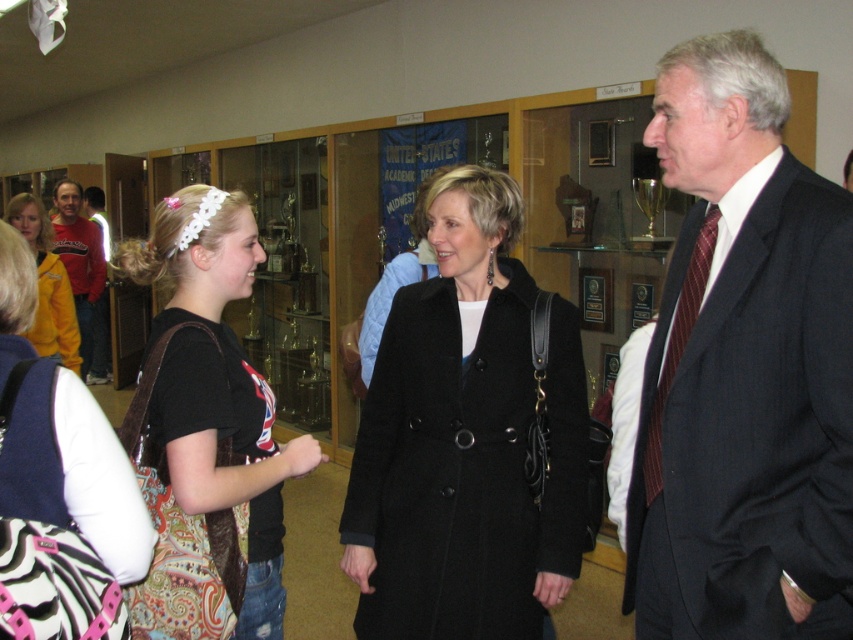
Please describe the position of the black cotton shirt at center in terms of its coordinates within the image frame. The image frame has a coordinate system where the origin is at the bottom left corner, with x increasing to the right and y increasing upwards. The coordinates are normalized between 0 and 1. You must mention the object label exactly as given in the Objects section in your answer.

The black cotton shirt at center is located at coordinates approximately 0.675 in the x direction and 0.242 in the y direction within the image frame.